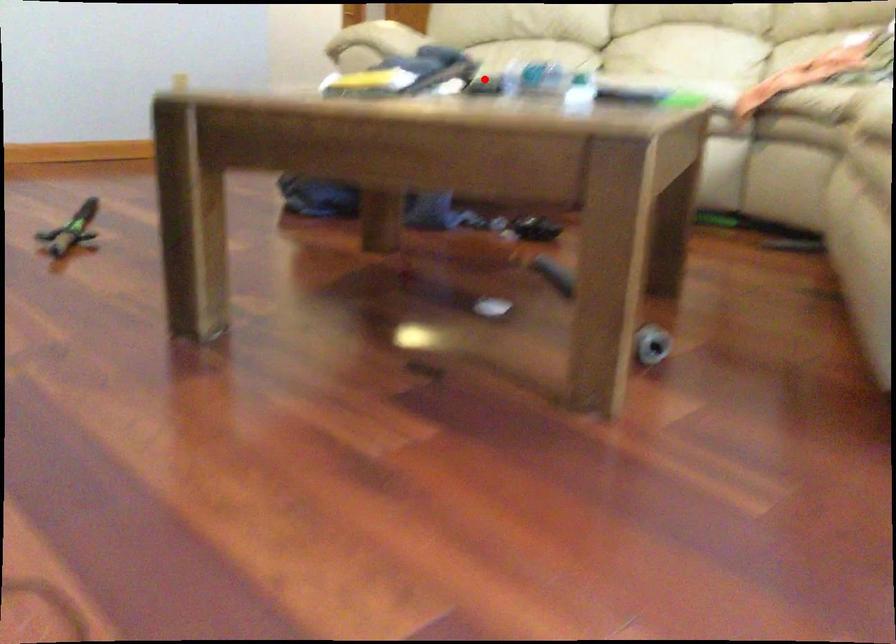
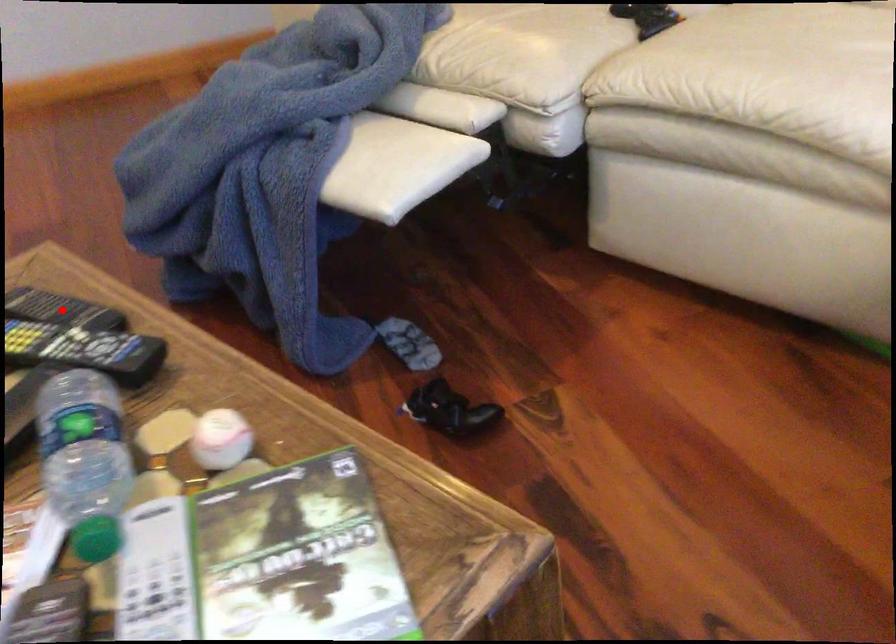
I am providing you with two images of the same scene from different viewpoints. A red point is marked on the first image and another point is marked on the second image. Do the highlighted points in image1 and image2 indicate the same real-world spot?

No